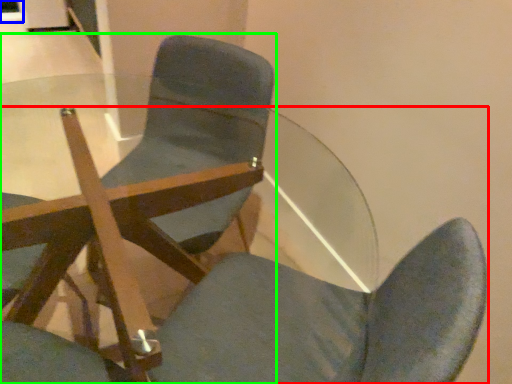
Question: Estimate the real-world distances between objects in this image. Which object is farther from chair (highlighted by a red box), glass door (highlighted by a blue box) or chair (highlighted by a green box)?

Choices:
 (A) glass door
 (B) chair

Answer: (A)